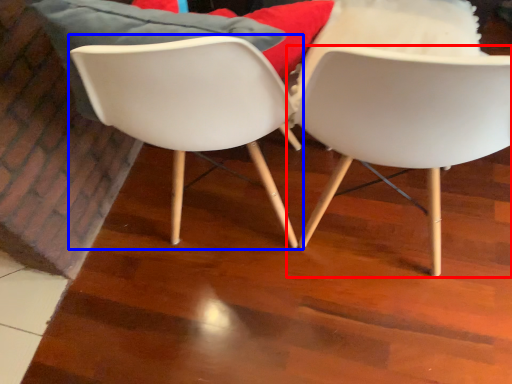
Question: Which point is further to the camera, chair (highlighted by a red box) or chair (highlighted by a blue box)?

Choices:
 (A) chair
 (B) chair

Answer: (B)